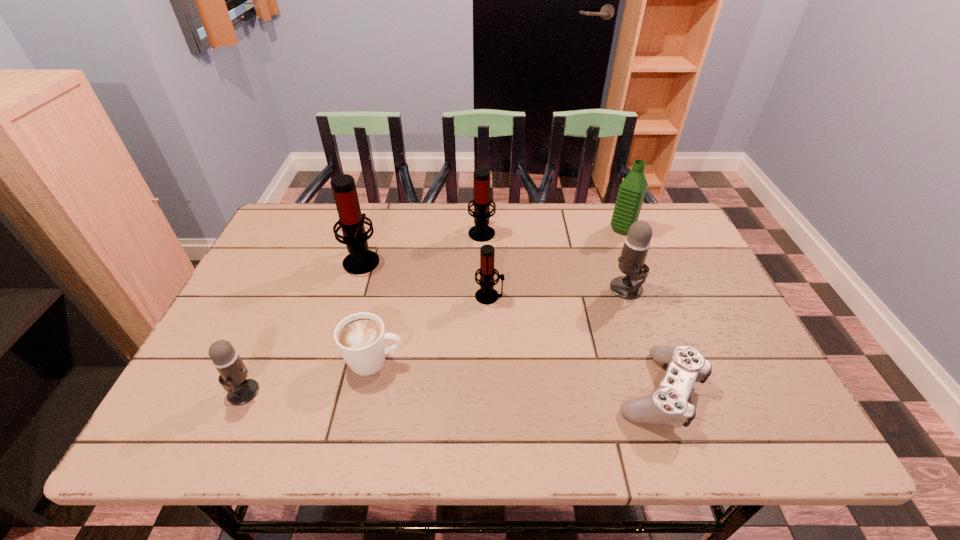
You are a GUI agent. You are given a task and a screenshot of the screen. Output one action in this format:
    pyautogui.click(x=<x>, y=<y>)
    Task: Click on the leftmost red microphone
    This screenshot has height=540, width=960.
    Given the screenshot: What is the action you would take?
    pyautogui.click(x=360, y=260)

Find the location of a particular element. the biggest red microphone is located at coordinates (360, 260).

This screenshot has width=960, height=540. In order to click on water bottle in this screenshot , I will do pyautogui.click(x=632, y=190).

At what (x,y) coordinates should I click in order to perform the action: click on the farthest microphone. Please return your answer as a coordinate pair (x, y). The height and width of the screenshot is (540, 960). Looking at the image, I should click on (481, 232).

The height and width of the screenshot is (540, 960). Identify the location of the second biggest red microphone. tap(481, 232).

The height and width of the screenshot is (540, 960). Find the location of `the farther gray microphone`. the farther gray microphone is located at coordinates (637, 242).

At what (x,y) coordinates should I click in order to perform the action: click on the bigger gray microphone. Please return your answer as a coordinate pair (x, y). Looking at the image, I should click on (637, 242).

Locate an element on the screen. This screenshot has width=960, height=540. the smallest red microphone is located at coordinates (486, 294).

Locate an element on the screen. the nearer gray microphone is located at coordinates (233, 373).

The image size is (960, 540). I want to click on the nearest microphone, so click(x=233, y=373).